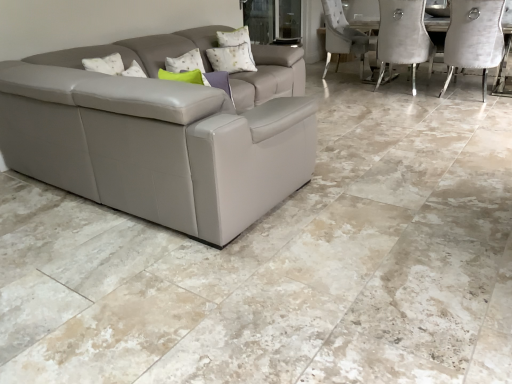
Question: Is velvet grey chair at upper right at the right side of white textured pillow at upper center?

Choices:
 (A) no
 (B) yes

Answer: (B)

Question: From the image's perspective, would you say velvet grey chair at upper right is shown under white textured pillow at upper center?

Choices:
 (A) yes
 (B) no

Answer: (B)

Question: Can white textured pillow at upper center be found inside velvet grey chair at upper right?

Choices:
 (A) yes
 (B) no

Answer: (B)

Question: Does velvet grey chair at upper right have a lesser width compared to white textured pillow at upper center?

Choices:
 (A) yes
 (B) no

Answer: (B)

Question: Does velvet grey chair at upper right touch white textured pillow at upper center?

Choices:
 (A) yes
 (B) no

Answer: (B)

Question: Is velvet grey chair at upper right at the left side of white textured pillow at upper center?

Choices:
 (A) no
 (B) yes

Answer: (A)

Question: From a real-world perspective, is transparent glass door at upper center located beneath velvet grey chair at upper right?

Choices:
 (A) no
 (B) yes

Answer: (A)

Question: Considering the relative sizes of transparent glass door at upper center and velvet grey chair at upper right in the image provided, is transparent glass door at upper center shorter than velvet grey chair at upper right?

Choices:
 (A) yes
 (B) no

Answer: (A)

Question: Considering the relative sizes of transparent glass door at upper center and velvet grey chair at upper right in the image provided, is transparent glass door at upper center bigger than velvet grey chair at upper right?

Choices:
 (A) no
 (B) yes

Answer: (A)

Question: Does transparent glass door at upper center turn towards velvet grey chair at upper right?

Choices:
 (A) yes
 (B) no

Answer: (A)

Question: Can you confirm if transparent glass door at upper center is positioned to the right of velvet grey chair at upper right?

Choices:
 (A) no
 (B) yes

Answer: (A)

Question: Does transparent glass door at upper center have a greater width compared to velvet grey chair at upper right?

Choices:
 (A) no
 (B) yes

Answer: (A)

Question: From the image's perspective, is white textured pillow at upper center under velvet grey chair at upper right?

Choices:
 (A) no
 (B) yes

Answer: (B)